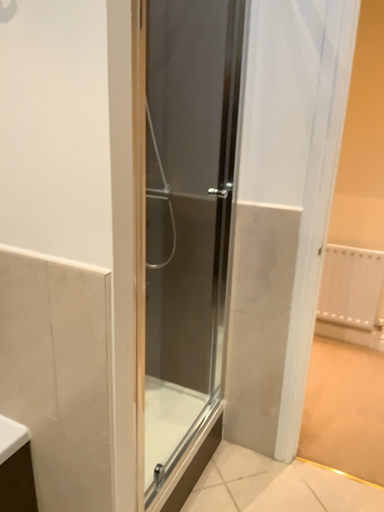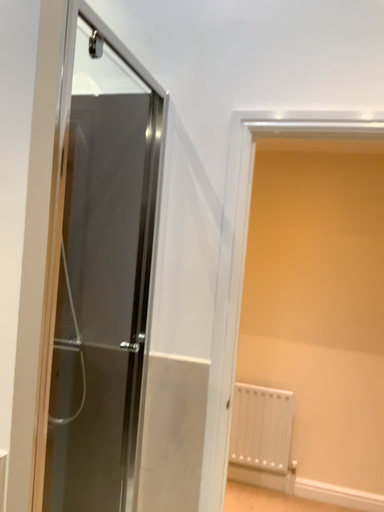
Question: How did the camera likely rotate when shooting the video?

Choices:
 (A) rotated right
 (B) rotated left

Answer: (A)